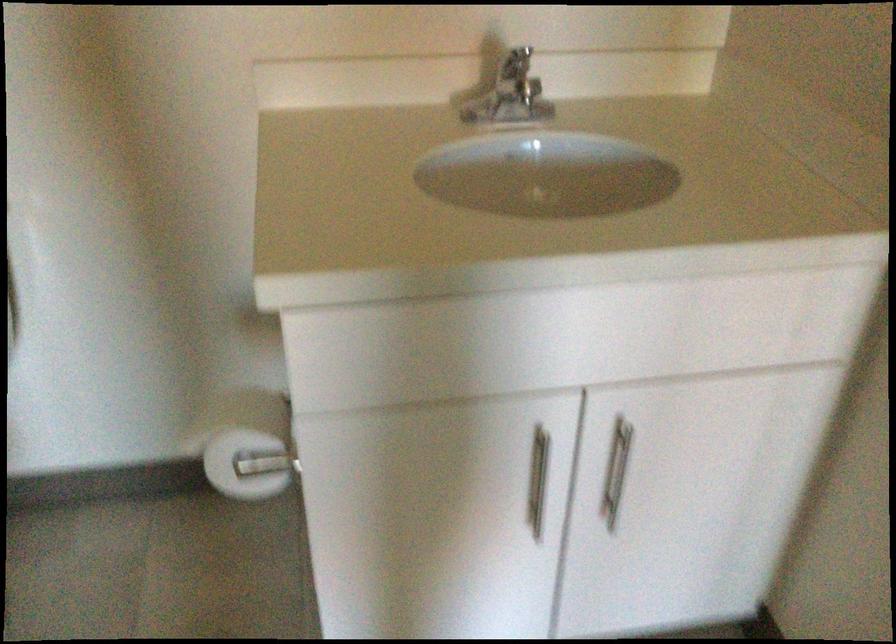
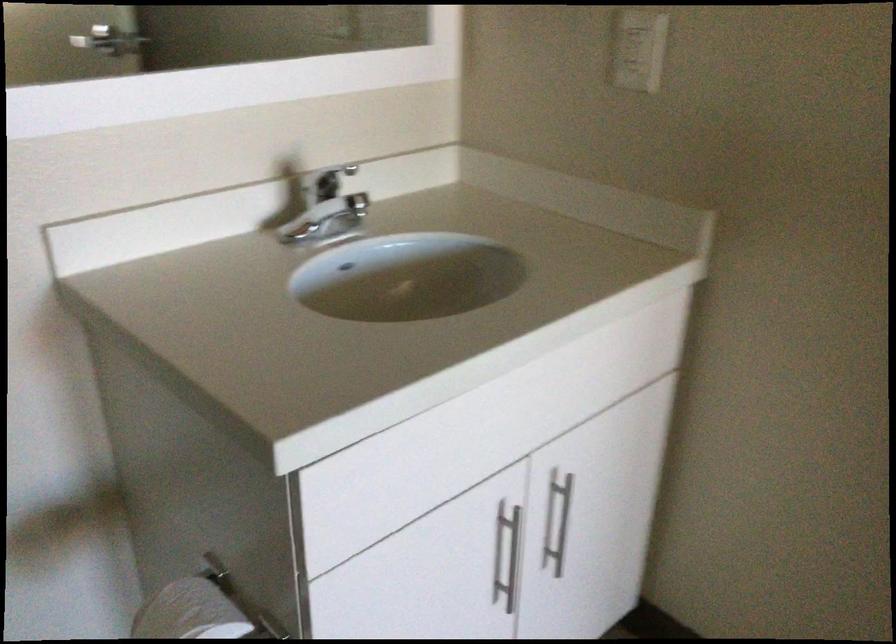
Question: How did the camera likely rotate?

Choices:
 (A) Left
 (B) Right
 (C) Up
 (D) Down

Answer: (B)